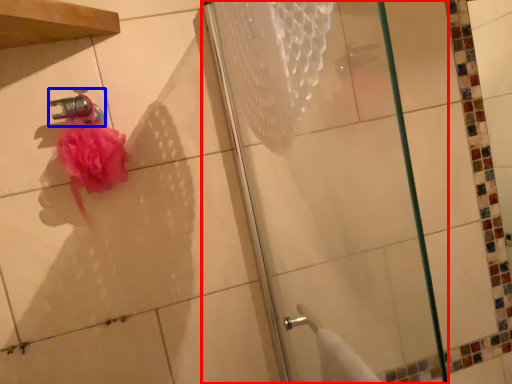
Question: Which point is further to the camera, shower (highlighted by a red box) or faucet (highlighted by a blue box)?

Choices:
 (A) shower
 (B) faucet

Answer: (B)